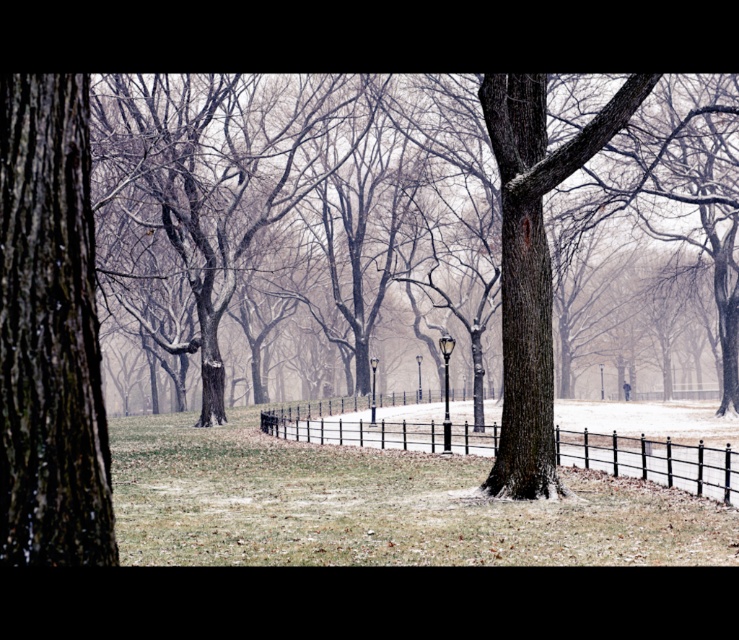
You are a painter setting up an easel in the winter scene. You want to paint both the smooth bark tree at center and the black metal fence at center. Which object should you focus on first if you want to paint the larger one?

The smooth bark tree at center is bigger than the black metal fence at center, so you should focus on painting the smooth bark tree at center first.

You are standing at the entrance of the park and see the smooth bark tree at center. If you walk straight towards the tree, will you encounter the curved black metal fence before reaching it?

The smooth bark tree at center is located at point (678, 189), which is beyond the curved black metal fence in the middle ground. Therefore, walking straight towards the tree would require passing through the fence first before reaching it.

Consider the image. You are planning to install a new bench that requires 30 feet of space between the smooth bark tree at center and the black metal fence at center. Based on the scene, is there enough space for the bench?

The distance between the smooth bark tree at center and the black metal fence at center is 28.59 feet, which is less than the required 30 feet. Therefore, there is not enough space for the bench.